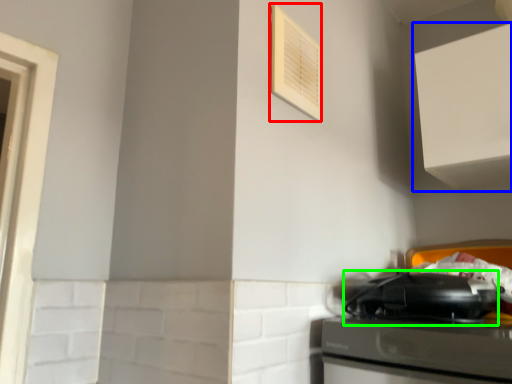
Question: Based on their relative distances, which object is nearer to air conditioner (highlighted by a red box)? Choose from cabinetry (highlighted by a blue box) and appliance (highlighted by a green box).

Choices:
 (A) cabinetry
 (B) appliance

Answer: (A)